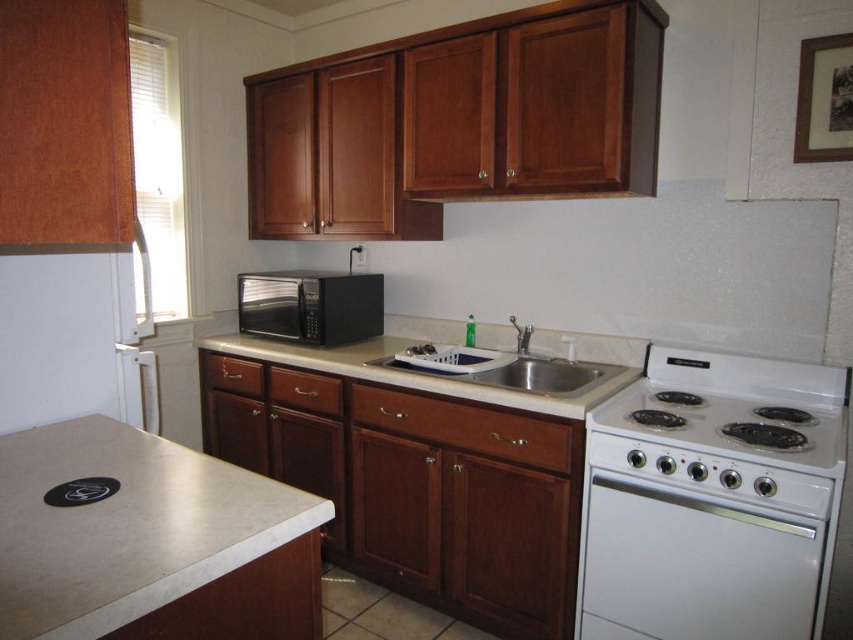
Question: Is stainless steel sink at center in front of black matte microwave at center?

Choices:
 (A) yes
 (B) no

Answer: (A)

Question: Does white glossy electric stove at right have a smaller size compared to beige laminate counter top at lower left?

Choices:
 (A) yes
 (B) no

Answer: (B)

Question: Which point appears farthest from the camera in this image?

Choices:
 (A) (418, 385)
 (B) (239, 305)
 (C) (296, 364)
 (D) (259, 570)

Answer: (B)

Question: Which point is closer to the camera?

Choices:
 (A) (689, 368)
 (B) (492, 340)
 (C) (515, 376)
 (D) (245, 300)

Answer: (A)

Question: Which of the following is the closest to the observer?

Choices:
 (A) (381, 296)
 (B) (831, 547)
 (C) (210, 637)
 (D) (486, 339)

Answer: (C)

Question: Where is beige laminate counter top at lower left located in relation to stainless steel sink at center in the image?

Choices:
 (A) right
 (B) left

Answer: (B)